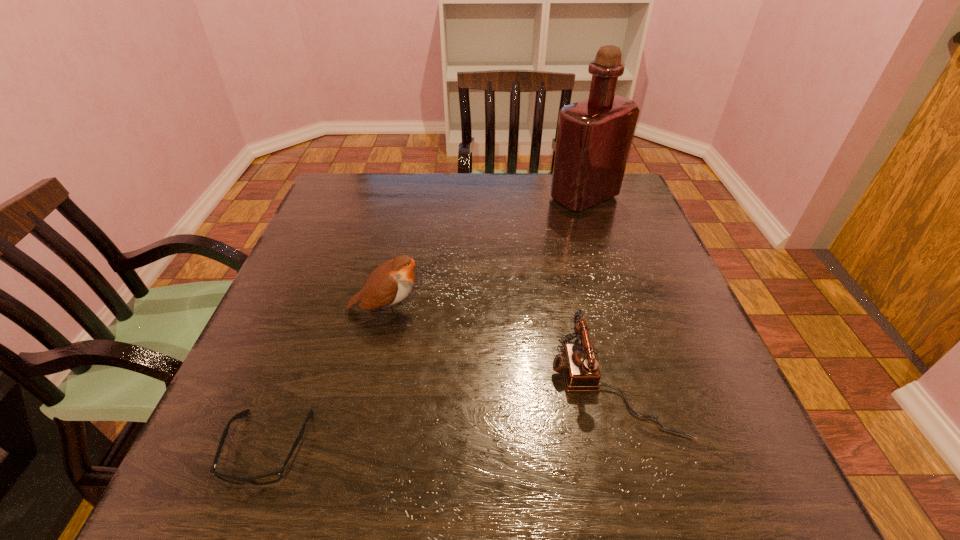
Where is `free point that satisfies the following two spatial constraints: 1. on the dial of the telephone; 2. on the front-facing side of the shortest object`? The image size is (960, 540). free point that satisfies the following two spatial constraints: 1. on the dial of the telephone; 2. on the front-facing side of the shortest object is located at coordinates (631, 448).